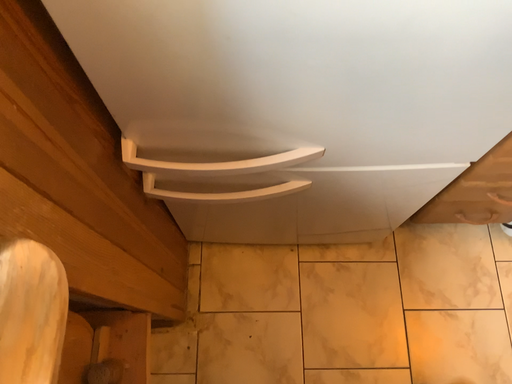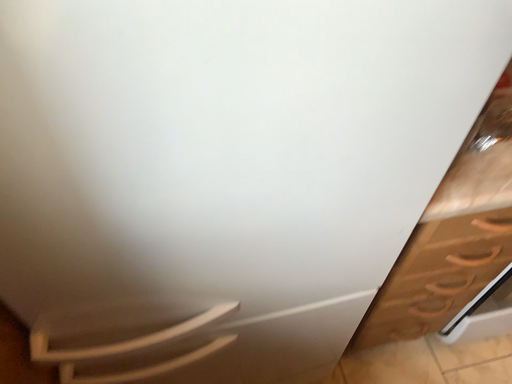
Question: Which way did the camera rotate in the video?

Choices:
 (A) rotated upward
 (B) rotated downward

Answer: (A)